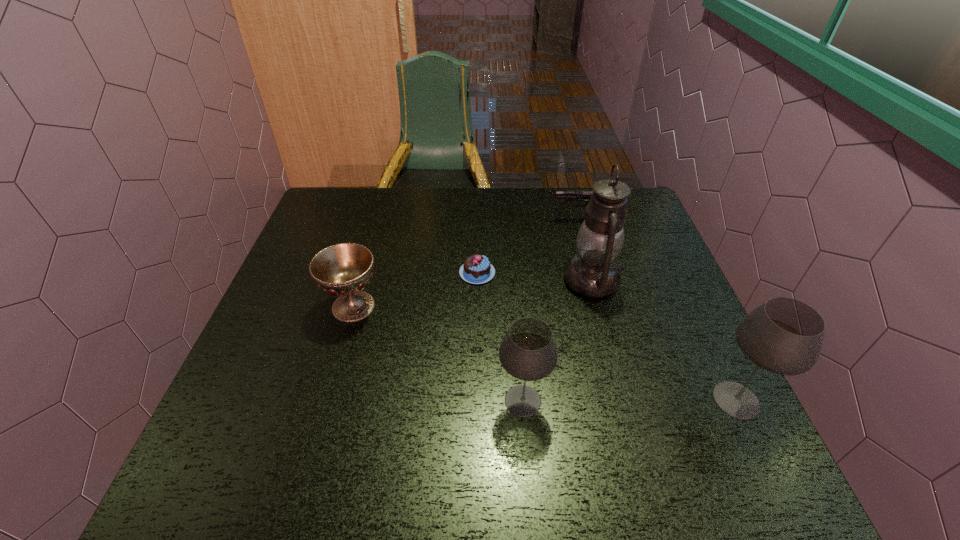
Locate an element on the screen. The width and height of the screenshot is (960, 540). the fourth closest object to the fourth tallest object is located at coordinates (560, 195).

Identify which object is the fourth nearest to the pistol. Please provide its 2D coordinates. Your answer should be formatted as a tuple, i.e. [(x, y)], where the tuple contains the x and y coordinates of a point satisfying the conditions above.

[(784, 336)]

I want to click on vacant space that satisfies the following two spatial constraints: 1. aim along the barrel of the farthest object; 2. on the back side of the rightmost object, so click(624, 400).

Where is `free point that satisfies the following two spatial constraints: 1. aim along the barrel of the farthest object; 2. on the right side of the tallest object`? The height and width of the screenshot is (540, 960). free point that satisfies the following two spatial constraints: 1. aim along the barrel of the farthest object; 2. on the right side of the tallest object is located at coordinates (592, 280).

Where is `vacant position in the image that satisfies the following two spatial constraints: 1. on the front side of the tallest object; 2. on the left side of the taller wineglass`? The image size is (960, 540). vacant position in the image that satisfies the following two spatial constraints: 1. on the front side of the tallest object; 2. on the left side of the taller wineglass is located at coordinates (624, 400).

This screenshot has width=960, height=540. What are the coordinates of `vacant space that satisfies the following two spatial constraints: 1. aim along the barrel of the second shortest object; 2. on the front side of the third shortest object` in the screenshot? It's located at (599, 306).